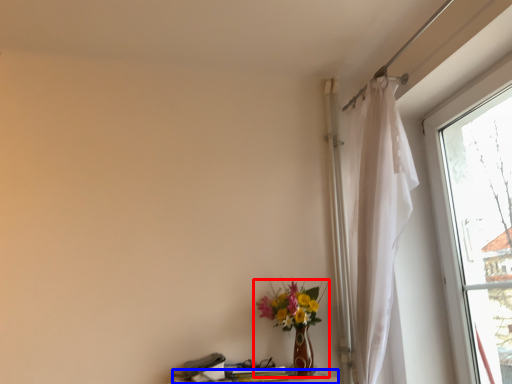
Question: Which of the following is the farthest to the observer, houseplant (highlighted by a red box) or table (highlighted by a blue box)?

Choices:
 (A) houseplant
 (B) table

Answer: (A)